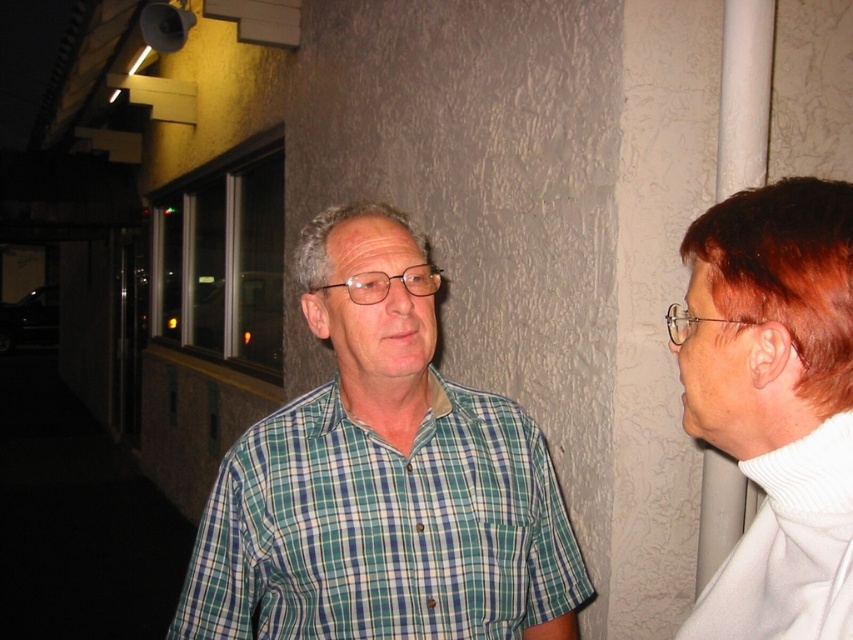
You are a photographer adjusting the camera focus. You need to ensure both the dark red hair at right and the gray matte hair at center are in focus. Which hair should you focus on first to achieve proper depth of field?

The dark red hair at right is much taller than the gray matte hair at center, so focusing on the dark red hair at right first would help achieve proper depth of field as it is farther away.